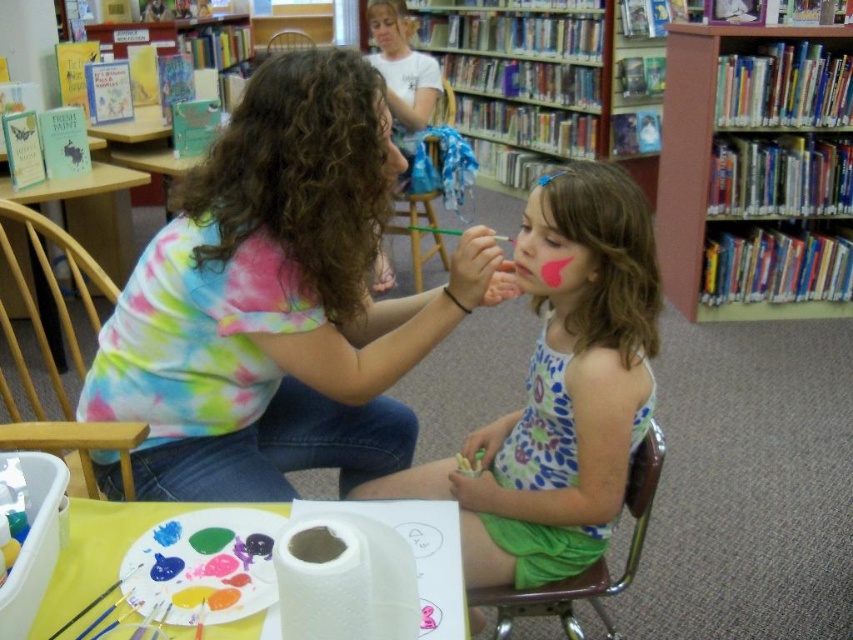
Does matte pink paint at center lie in front of pink matte paint at center?

Yes, it is.

Looking at this image, is matte pink paint at center to the right of pink matte paint at center from the viewer's perspective?

Incorrect, matte pink paint at center is not on the right side of pink matte paint at center.

Is point (514, 557) farther from viewer compared to point (526, 284)?

That is True.

What are the coordinates of `matte pink paint at center` in the screenshot? It's located at (560, 390).

Is white paper towel at lower center below matte skin face at center?

Indeed, white paper towel at lower center is positioned under matte skin face at center.

Does white paper towel at lower center appear over matte skin face at center?

No.

The width and height of the screenshot is (853, 640). Describe the element at coordinates (345, 579) in the screenshot. I see `white paper towel at lower center` at that location.

The width and height of the screenshot is (853, 640). In order to click on white paper towel at lower center in this screenshot , I will do `click(345, 579)`.

Can you confirm if matte pink paint at center is shorter than wooden chair at upper center?

In fact, matte pink paint at center may be taller than wooden chair at upper center.

Is matte pink paint at center bigger than wooden chair at upper center?

Yes.

I want to click on matte pink paint at center, so click(x=560, y=390).